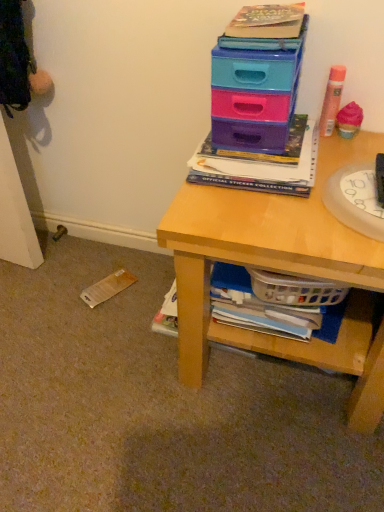
I want to click on blank space situated above wooden desk at upper right (from a real-world perspective), so click(302, 183).